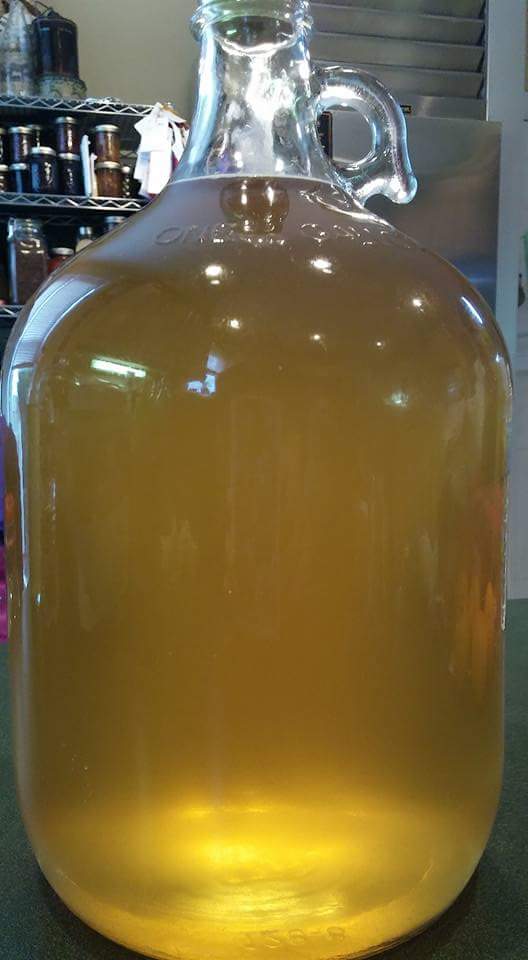
The height and width of the screenshot is (960, 528). Identify the location of walls. (164, 57), (508, 62).